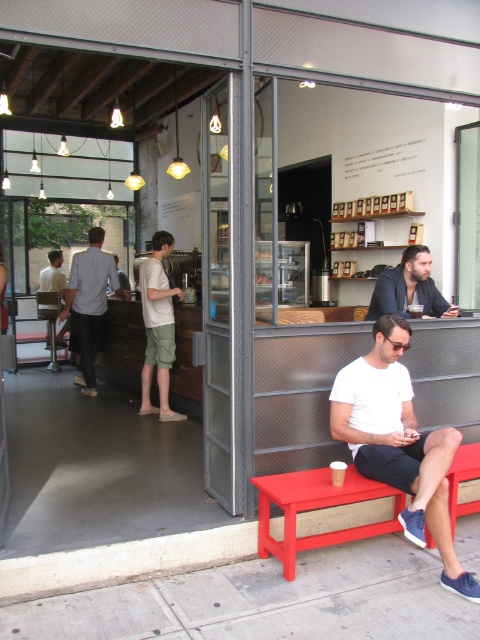
You are a customer standing on the sidewalk in front of the modern cafe. You see a point marked at coordinates (315, 508). Based on the scene description, which object is this point located on?

The point is located on the matte red bench at lower center.

You are standing at the entrance of the modern cafe and want to sit on the matte red bench at lower center. What are the coordinates of the bench?

The coordinates of the matte red bench at lower center are point (315, 508).